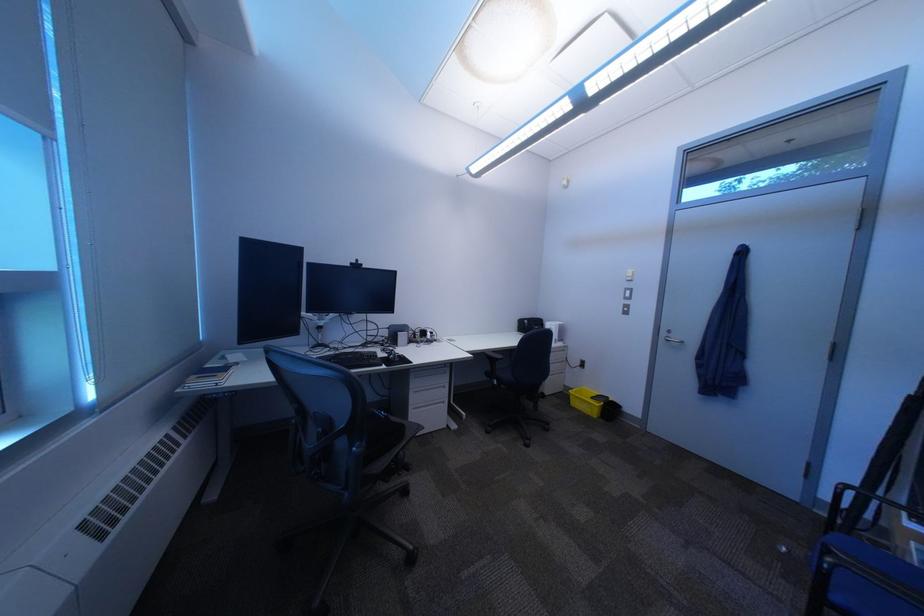
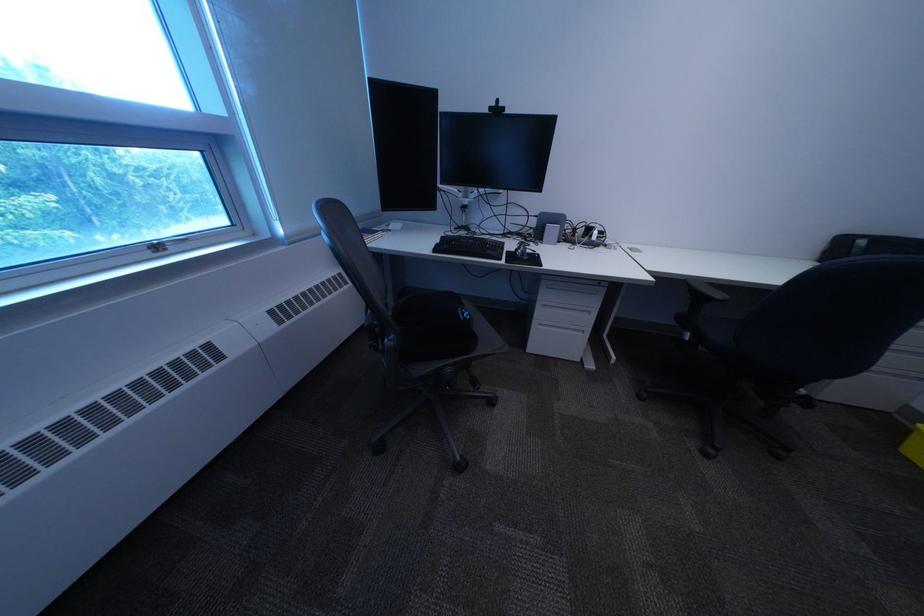
The point at (x=430, y=394) is marked in the first image. Where is the corresponding point in the second image?

(558, 307)